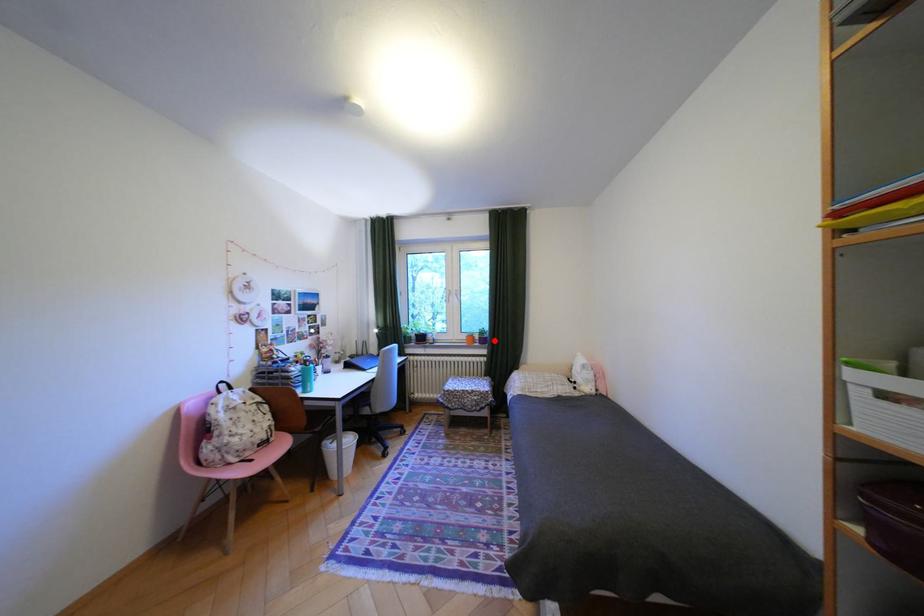
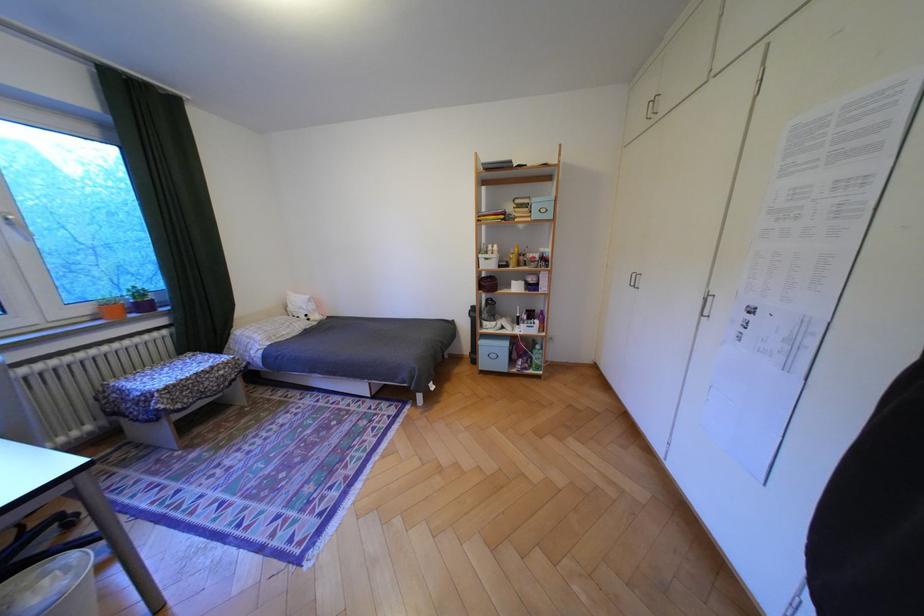
In the second image, find the point that corresponds to the highlighted location in the first image.

(155, 307)